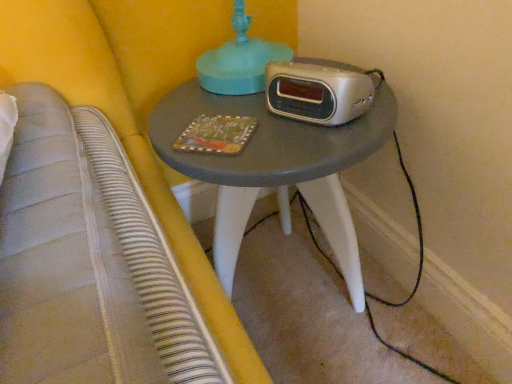
Question: Should I look upward or downward to see matte gray table at center?

Choices:
 (A) up
 (B) down

Answer: (B)

Question: Can you confirm if matte gray table at center is wider than wooden painted book at center?

Choices:
 (A) no
 (B) yes

Answer: (B)

Question: Is matte gray table at center far away from wooden painted book at center?

Choices:
 (A) yes
 (B) no

Answer: (B)

Question: Would you say matte gray table at center is outside wooden painted book at center?

Choices:
 (A) yes
 (B) no

Answer: (A)

Question: Would you say wooden painted book at center is part of matte gray table at center's contents?

Choices:
 (A) no
 (B) yes

Answer: (B)

Question: Is matte gray table at center positioned with its back to wooden painted book at center?

Choices:
 (A) yes
 (B) no

Answer: (B)

Question: From a real-world perspective, is matte gray table at center physically below wooden painted book at center?

Choices:
 (A) no
 (B) yes

Answer: (B)

Question: Is silver metallic alarm clock at center facing towards wooden painted book at center?

Choices:
 (A) yes
 (B) no

Answer: (A)

Question: Is silver metallic alarm clock at center at the left side of wooden painted book at center?

Choices:
 (A) no
 (B) yes

Answer: (A)

Question: Is wooden painted book at center a part of silver metallic alarm clock at center?

Choices:
 (A) no
 (B) yes

Answer: (A)

Question: Is silver metallic alarm clock at center turned away from wooden painted book at center?

Choices:
 (A) no
 (B) yes

Answer: (A)

Question: Is silver metallic alarm clock at center smaller than wooden painted book at center?

Choices:
 (A) yes
 (B) no

Answer: (B)

Question: From a real-world perspective, is silver metallic alarm clock at center below wooden painted book at center?

Choices:
 (A) no
 (B) yes

Answer: (A)

Question: From the image's perspective, does silver metallic alarm clock at center appear higher than matte gray table at center?

Choices:
 (A) no
 (B) yes

Answer: (B)